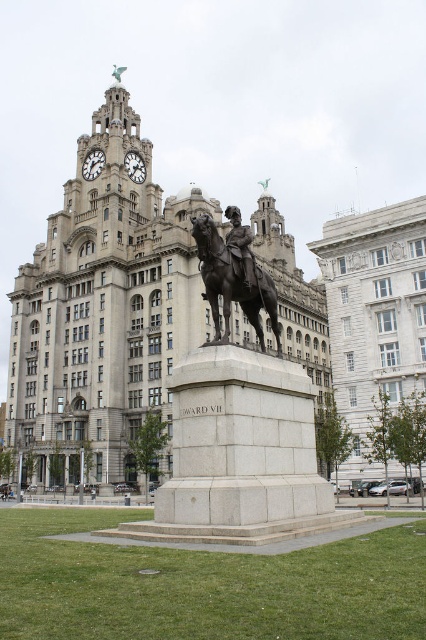
Question: Which object is farther from the camera taking this photo?

Choices:
 (A) polished bronze horse at center
 (B) polished bronze statue at center

Answer: (B)

Question: Can you confirm if gray stone tower at center is positioned below polished bronze horse at center?

Choices:
 (A) yes
 (B) no

Answer: (B)

Question: Is gray stone tower at center in front of polished bronze horse at center?

Choices:
 (A) yes
 (B) no

Answer: (B)

Question: Which object is closer to the camera taking this photo?

Choices:
 (A) polished bronze statue at center
 (B) gray stone tower at center

Answer: (A)

Question: Does gray stone tower at center have a larger size compared to polished bronze horse at center?

Choices:
 (A) no
 (B) yes

Answer: (B)

Question: Which of the following is the closest to the observer?

Choices:
 (A) polished bronze statue at center
 (B) polished bronze horse at center

Answer: (B)